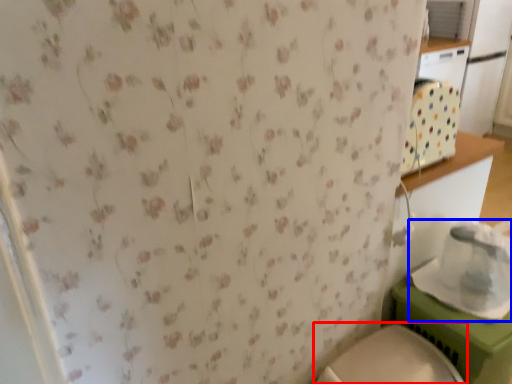
Question: Which point is further to the camera, toilet (highlighted by a red box) or appliance (highlighted by a blue box)?

Choices:
 (A) toilet
 (B) appliance

Answer: (B)